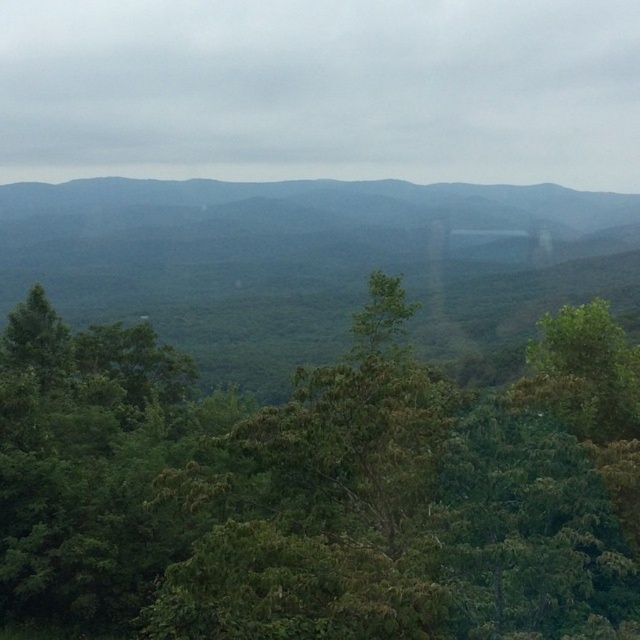
Between green leafy tree at center and green leafy forest at center, which one has more height?

green leafy forest at center is taller.

Is green leafy tree at center positioned at the back of green leafy forest at center?

No.

Is point (589, 348) closer to viewer compared to point (429, 200)?

Yes, it is.

Locate an element on the screen. green leafy tree at center is located at coordinates (320, 486).